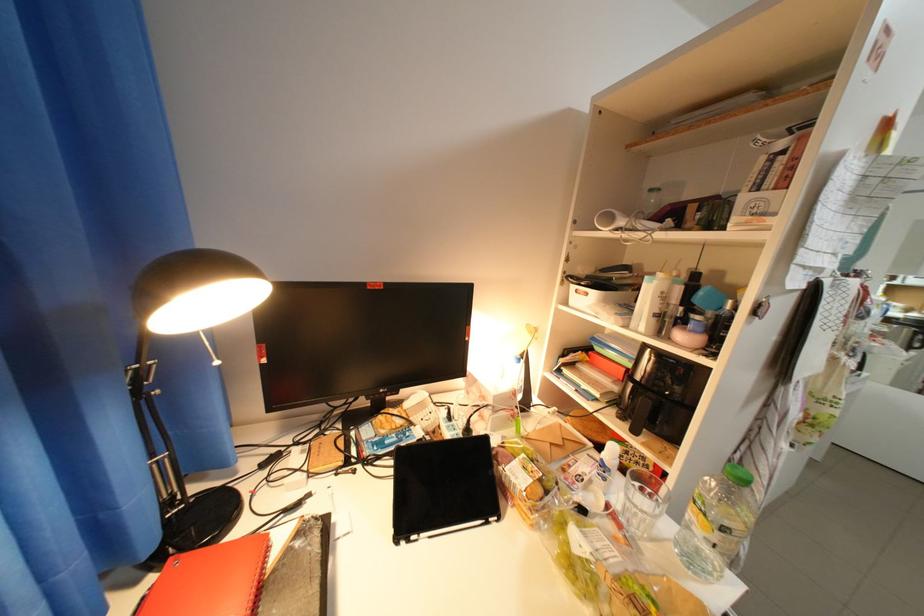
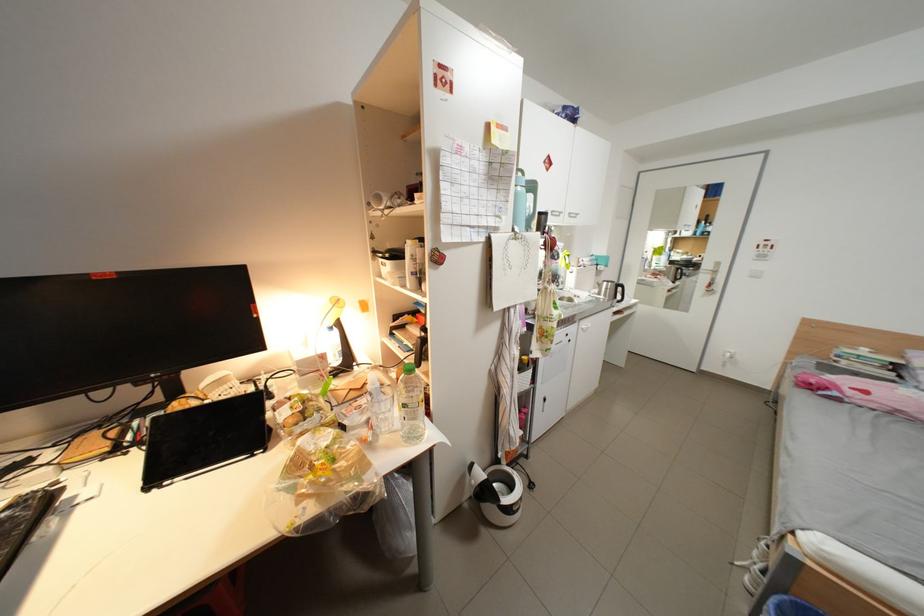
Where in the second image is the point corresponding to (x=527, y=395) from the first image?

(334, 358)